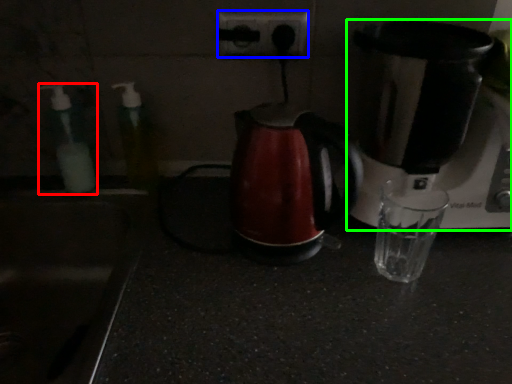
Question: Considering the real-world distances, which object is farthest from bottle (highlighted by a red box)? power plugs and sockets (highlighted by a blue box) or coffee maker (highlighted by a green box)?

Choices:
 (A) power plugs and sockets
 (B) coffee maker

Answer: (B)